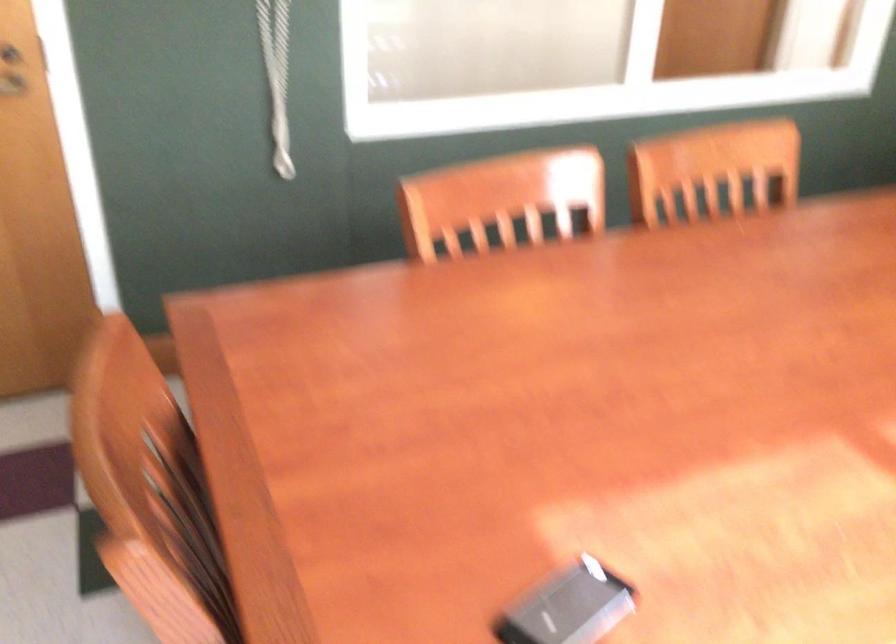
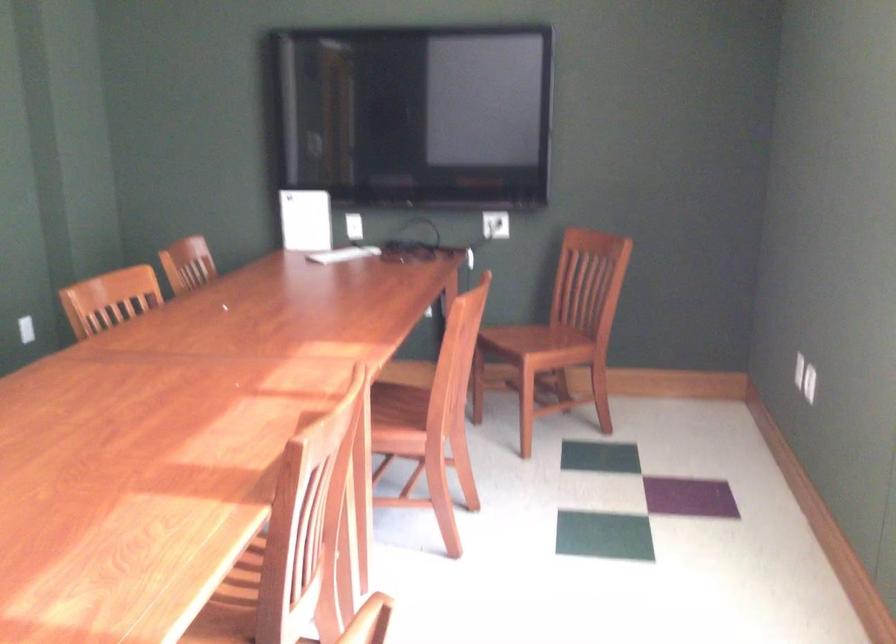
Question: The first image is from the beginning of the video and the second image is from the end. How did the camera likely rotate when shooting the video?

Choices:
 (A) Left
 (B) Right
 (C) Up
 (D) Down

Answer: (B)